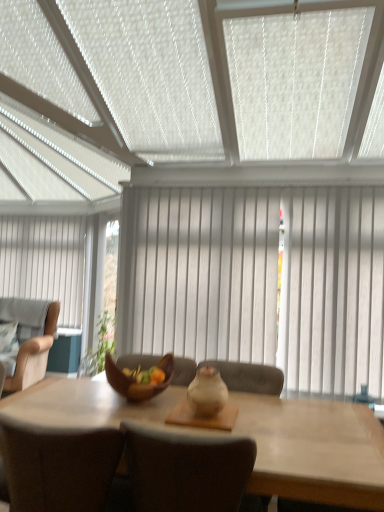
Measure the distance between point (x=166, y=367) and camera.

A distance of 2.30 meters exists between point (x=166, y=367) and camera.

What do you see at coordinates (257, 281) in the screenshot?
I see `white wood curtain at center, positioned as the second curtain in left-to-right order` at bounding box center [257, 281].

Image resolution: width=384 pixels, height=512 pixels. Identify the location of brown fabric chair at center, acting as the 3th chair starting from the back. (186, 470).

This screenshot has width=384, height=512. What do you see at coordinates (34, 355) in the screenshot?
I see `beige fabric armchair at left, marked as the 3th chair in a front-to-back arrangement` at bounding box center [34, 355].

You are a GUI agent. You are given a task and a screenshot of the screen. Output one action in this format:
    pyautogui.click(x=<x>, y=<y>)
    Task: Click on the white textured window blind at upper center
    
    Given the screenshot: What is the action you would take?
    (x=193, y=92)

Locate an element on the screen. The width and height of the screenshot is (384, 512). matte beige chair at center, positioned as the first chair in right-to-left order is located at coordinates (248, 377).

The height and width of the screenshot is (512, 384). What do you see at coordinates (248, 377) in the screenshot? I see `matte beige chair at center, positioned as the first chair in right-to-left order` at bounding box center [248, 377].

Identify the location of brown woven bowl at center. (134, 382).

Is white fabric curtain at left, which is the first curtain in back-to-front order, directly adjacent to white textured window blind at upper center?

No, white fabric curtain at left, which is the first curtain in back-to-front order, is not touching white textured window blind at upper center.

Measure the distance from white fabric curtain at left, which ranks as the second curtain in front-to-back order, to white textured window blind at upper center.

white fabric curtain at left, which ranks as the second curtain in front-to-back order, is 9.62 feet from white textured window blind at upper center.

Does white fabric curtain at left, which is the first curtain in back-to-front order, appear on the left side of white textured window blind at upper center?

Correct, you'll find white fabric curtain at left, which is the first curtain in back-to-front order, to the left of white textured window blind at upper center.

Considering the relative sizes of white fabric curtain at left, which ranks as the second curtain in front-to-back order, and white textured window blind at upper center in the image provided, is white fabric curtain at left, which ranks as the second curtain in front-to-back order, thinner than white textured window blind at upper center?

Yes, white fabric curtain at left, which ranks as the second curtain in front-to-back order, is thinner than white textured window blind at upper center.

Considering the sizes of matte beige chair at center, the second chair viewed from the back, and brown woven bowl at center in the image, is matte beige chair at center, the second chair viewed from the back, taller or shorter than brown woven bowl at center?

In the image, matte beige chair at center, the second chair viewed from the back, appears to be taller than brown woven bowl at center.

From the image's perspective, which one is positioned higher, matte beige chair at center, the second chair viewed from the back, or brown woven bowl at center?

brown woven bowl at center is shown above in the image.

In terms of size, does matte beige chair at center, positioned as the first chair in right-to-left order, appear bigger or smaller than brown woven bowl at center?

Clearly, matte beige chair at center, positioned as the first chair in right-to-left order, is larger in size than brown woven bowl at center.

Is matte beige chair at center, the 2th chair when ordered from front to back, to the right of brown woven bowl at center from the viewer's perspective?

Yes, matte beige chair at center, the 2th chair when ordered from front to back, is to the right of brown woven bowl at center.

Considering the relative positions of brown woven bowl at center and brown fabric chair at center, the first chair in the front-to-back sequence, in the image provided, is brown woven bowl at center behind brown fabric chair at center, the first chair in the front-to-back sequence,?

Yes, the depth of brown woven bowl at center is greater than that of brown fabric chair at center, the first chair in the front-to-back sequence.

From a real-world perspective, relative to brown fabric chair at center, acting as the 3th chair starting from the back, is brown woven bowl at center vertically above or below?

brown woven bowl at center is above brown fabric chair at center, acting as the 3th chair starting from the back.

Who is smaller, brown woven bowl at center or brown fabric chair at center, which ranks as the 2th chair in left-to-right order?

Smaller between the two is brown woven bowl at center.

Who is shorter, brown woven bowl at center or brown fabric chair at center, positioned as the 2th chair in right-to-left order?

brown woven bowl at center.

Between white textured window blind at upper center and white wood curtain at center, positioned as the second curtain in left-to-right order, which one is positioned behind?

white wood curtain at center, positioned as the second curtain in left-to-right order, is further away from the camera.

Is white textured window blind at upper center taller or shorter than white wood curtain at center, positioned as the second curtain in left-to-right order?

Clearly, white textured window blind at upper center is shorter compared to white wood curtain at center, positioned as the second curtain in left-to-right order.

From a real-world perspective, is white textured window blind at upper center above or below white wood curtain at center, arranged as the first curtain when viewed from the right?

Clearly, from a real-world perspective, white textured window blind at upper center is above white wood curtain at center, arranged as the first curtain when viewed from the right.

Is white wood curtain at center, which ranks as the first curtain in front-to-back order, surrounded by white textured window blind at upper center?

No.

How distant is brown fabric chair at center, positioned as the 2th chair in right-to-left order, from white wood curtain at center, the second curtain in the back-to-front sequence?

4.88 feet.

Considering the positions of point (198, 463) and point (257, 216), is point (198, 463) closer or farther from the camera than point (257, 216)?

Point (198, 463) appears to be closer to the viewer than point (257, 216).

Is white wood curtain at center, positioned as the second curtain in left-to-right order, a part of brown fabric chair at center, acting as the 3th chair starting from the back?

No, white wood curtain at center, positioned as the second curtain in left-to-right order, is not inside brown fabric chair at center, acting as the 3th chair starting from the back.

Locate an element on the screen. the 2nd chair counting from the left side of the white wood curtain at center, positioned as the second curtain in left-to-right order is located at coordinates pos(186,470).

Is light brown wooden table at center positioned beyond the bounds of white fabric curtain at left, placed as the 1th curtain when sorted from left to right?

light brown wooden table at center is positioned outside white fabric curtain at left, placed as the 1th curtain when sorted from left to right.

Measure the distance between light brown wooden table at center and white fabric curtain at left, which ranks as the second curtain in front-to-back order.

light brown wooden table at center and white fabric curtain at left, which ranks as the second curtain in front-to-back order, are 11.20 feet apart from each other.

Is point (310, 463) positioned in front of point (19, 234)?

Yes.

Is light brown wooden table at center not near white fabric curtain at left, which is the first curtain in back-to-front order?

Yes.

Can you confirm if white fabric curtain at left, the second curtain positioned from the right, is bigger than matte beige chair at center, arranged as the third chair when viewed from the left?

Correct, white fabric curtain at left, the second curtain positioned from the right, is larger in size than matte beige chair at center, arranged as the third chair when viewed from the left.

From a real-world perspective, which is physically above, white fabric curtain at left, placed as the 1th curtain when sorted from left to right, or matte beige chair at center, arranged as the third chair when viewed from the left?

white fabric curtain at left, placed as the 1th curtain when sorted from left to right.

Considering the relative positions of white fabric curtain at left, which ranks as the second curtain in front-to-back order, and matte beige chair at center, arranged as the third chair when viewed from the left, in the image provided, is white fabric curtain at left, which ranks as the second curtain in front-to-back order, behind matte beige chair at center, arranged as the third chair when viewed from the left,?

Yes, it is behind matte beige chair at center, arranged as the third chair when viewed from the left.

Is white fabric curtain at left, which ranks as the second curtain in front-to-back order, facing away from matte beige chair at center, positioned as the first chair in right-to-left order?

white fabric curtain at left, which ranks as the second curtain in front-to-back order, is not turned away from matte beige chair at center, positioned as the first chair in right-to-left order.

From the image's perspective, which curtain is the 1st one below the white textured window blind at upper center? Please provide its 2D coordinates.

[(44, 262)]

At what (x,y) coordinates should I click in order to perform the action: click on bowl that is on the left side of matte beige chair at center, the second chair viewed from the back. Please return your answer as a coordinate pair (x, y). The height and width of the screenshot is (512, 384). Looking at the image, I should click on (134, 382).

Looking at this image, which object lies nearer to the anchor point matte beige chair at center, positioned as the first chair in right-to-left order, white fabric curtain at left, which ranks as the second curtain in front-to-back order, or beige fabric armchair at left, the 1th chair viewed from the left?

The object closer to matte beige chair at center, positioned as the first chair in right-to-left order, is beige fabric armchair at left, the 1th chair viewed from the left.

Estimate the real-world distances between objects in this image. Which object is further from light brown wooden table at center, white wood curtain at center, the second curtain in the back-to-front sequence, or white textured window blind at upper center?

white textured window blind at upper center.

Estimate the real-world distances between objects in this image. Which object is closer to matte beige chair at center, the 2th chair when ordered from front to back, light brown wooden table at center or beige fabric armchair at left, arranged as the first chair when viewed from the back?

light brown wooden table at center.

When comparing their distances from light brown wooden table at center, does white textured window blind at upper center or white fabric curtain at left, which ranks as the second curtain in front-to-back order, seem further?

Based on the image, white fabric curtain at left, which ranks as the second curtain in front-to-back order, appears to be further to light brown wooden table at center.

From the image, which object appears to be nearer to white textured window blind at upper center, brown fabric chair at center, which ranks as the 2th chair in left-to-right order, or brown woven bowl at center?

brown woven bowl at center is closer to white textured window blind at upper center.

Looking at the image, which one is located closer to brown woven bowl at center, brown fabric chair at center, the first chair in the front-to-back sequence, or beige fabric armchair at left, the 1th chair viewed from the left?

The object closer to brown woven bowl at center is brown fabric chair at center, the first chair in the front-to-back sequence.

Based on their spatial positions, is brown fabric chair at center, acting as the 3th chair starting from the back, or brown woven bowl at center closer to beige fabric armchair at left, arranged as the first chair when viewed from the back?

brown woven bowl at center is closer to beige fabric armchair at left, arranged as the first chair when viewed from the back.

Based on their spatial positions, is white textured window blind at upper center or white wood curtain at center, which ranks as the first curtain in front-to-back order, further from matte beige chair at center, arranged as the third chair when viewed from the left?

Among the two, white textured window blind at upper center is located further to matte beige chair at center, arranged as the third chair when viewed from the left.

Image resolution: width=384 pixels, height=512 pixels. In order to click on bowl between white textured window blind at upper center and beige fabric armchair at left, the 1th chair viewed from the left, along the z-axis in this screenshot , I will do `click(134, 382)`.

Locate an element on the screen. This screenshot has width=384, height=512. bowl between light brown wooden table at center and beige fabric armchair at left, the third chair in the right-to-left sequence, from front to back is located at coordinates point(134,382).

I want to click on chair between brown fabric chair at center, the first chair in the front-to-back sequence, and white wood curtain at center, the second curtain in the back-to-front sequence, in the front-back direction, so click(248, 377).

This screenshot has height=512, width=384. Identify the location of bowl between white textured window blind at upper center and light brown wooden table at center from top to bottom. (134, 382).